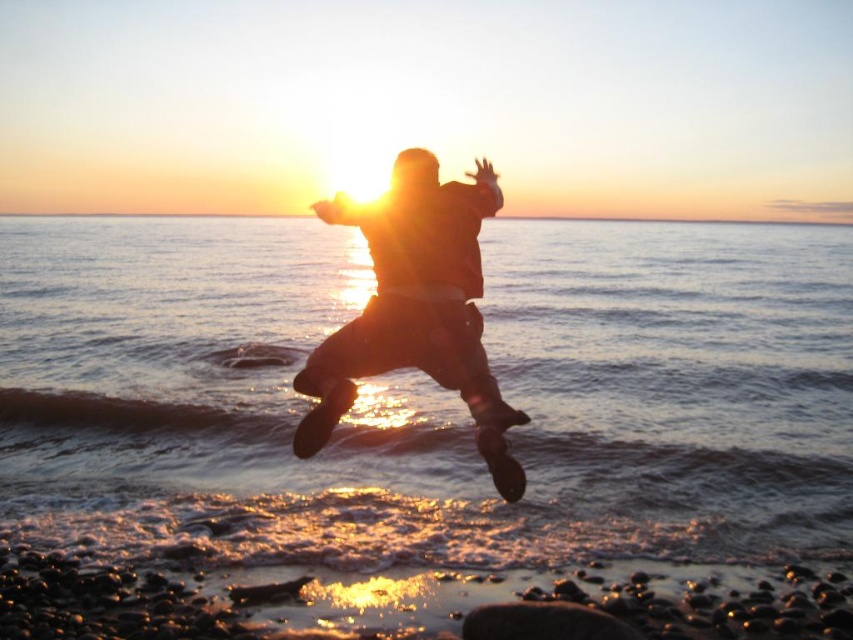
Is translucent water at center thinner than silhouette leather jacket at center?

No.

Is translucent water at center positioned behind silhouette leather jacket at center?

Yes, it is behind silhouette leather jacket at center.

Image resolution: width=853 pixels, height=640 pixels. Find the location of `translucent water at center`. translucent water at center is located at coordinates (424, 401).

In order to click on translucent water at center in this screenshot , I will do [424, 401].